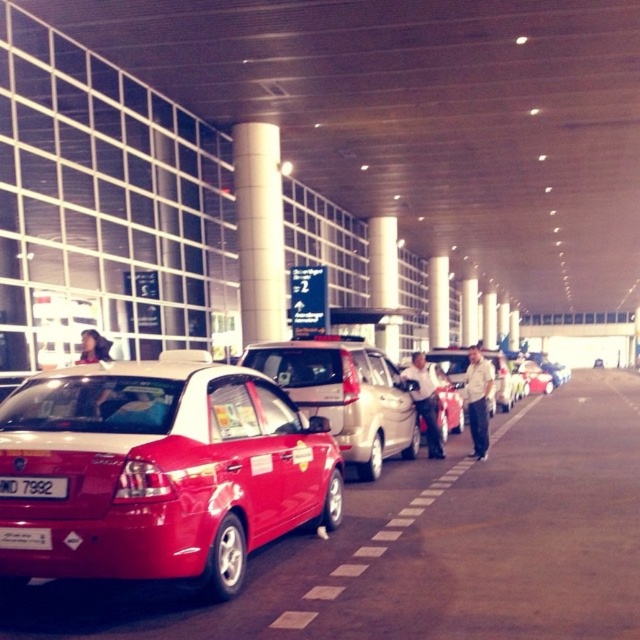
Based on the photo, you are a photographer standing at the taxi stand in the airport terminal. You want to take a photo of the shiny red sedan at center and the black plastic license plate at lower left. Which object should you focus on first if you want to capture both in the frame without moving the camera?

The shiny red sedan at center is larger in size than the black plastic license plate at lower left, so you should focus on the shiny red sedan at center first to ensure it fills the frame appropriately before adjusting for the smaller license plate.